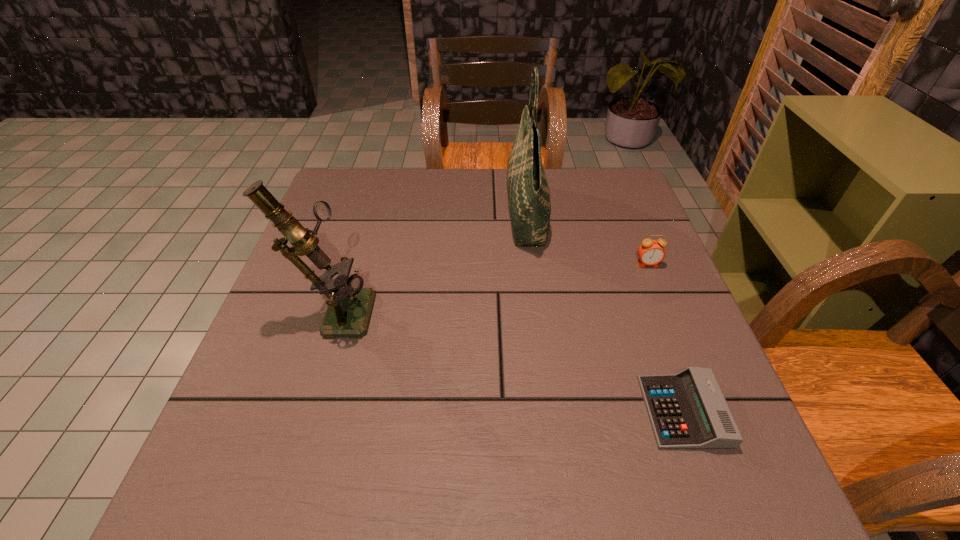
Find the location of a particular element. The width and height of the screenshot is (960, 540). tote bag is located at coordinates (528, 192).

This screenshot has width=960, height=540. Find the location of `the tallest object`. the tallest object is located at coordinates [x=528, y=192].

Where is `the leftmost object`? the leftmost object is located at coordinates (349, 308).

The image size is (960, 540). Find the location of `the second nearest object`. the second nearest object is located at coordinates (349, 308).

This screenshot has height=540, width=960. In order to click on the third tallest object in this screenshot , I will do `click(651, 252)`.

The height and width of the screenshot is (540, 960). In order to click on alarm clock in this screenshot , I will do `click(651, 252)`.

Locate an element on the screen. This screenshot has height=540, width=960. the nearest object is located at coordinates (687, 410).

The image size is (960, 540). I want to click on calculator, so click(687, 410).

Where is `vacant position located 0.280m on the right of the second object from left to right`? This screenshot has height=540, width=960. vacant position located 0.280m on the right of the second object from left to right is located at coordinates (646, 214).

The width and height of the screenshot is (960, 540). What are the coordinates of `vacant space located at the eyepiece of the microscope` in the screenshot? It's located at (443, 309).